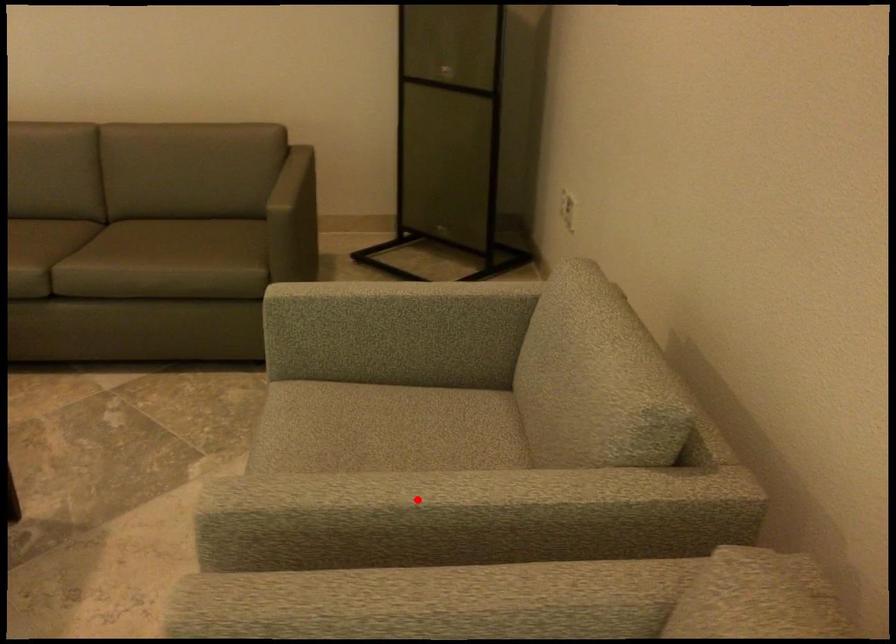
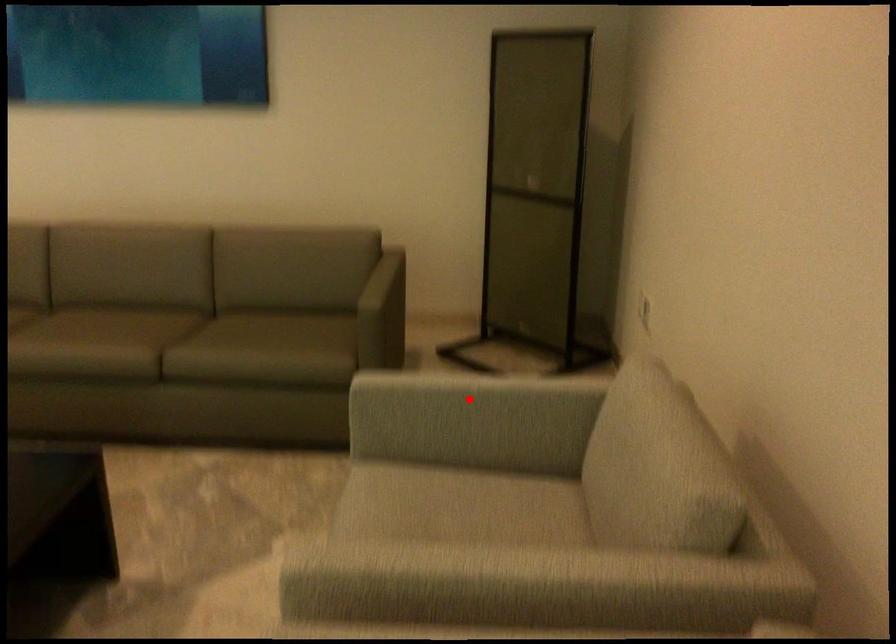
I am providing you with two images of the same scene from different viewpoints. A red point is marked on the first image and another point is marked on the second image. Are the points marked in image1 and image2 representing the same 3D position?

No